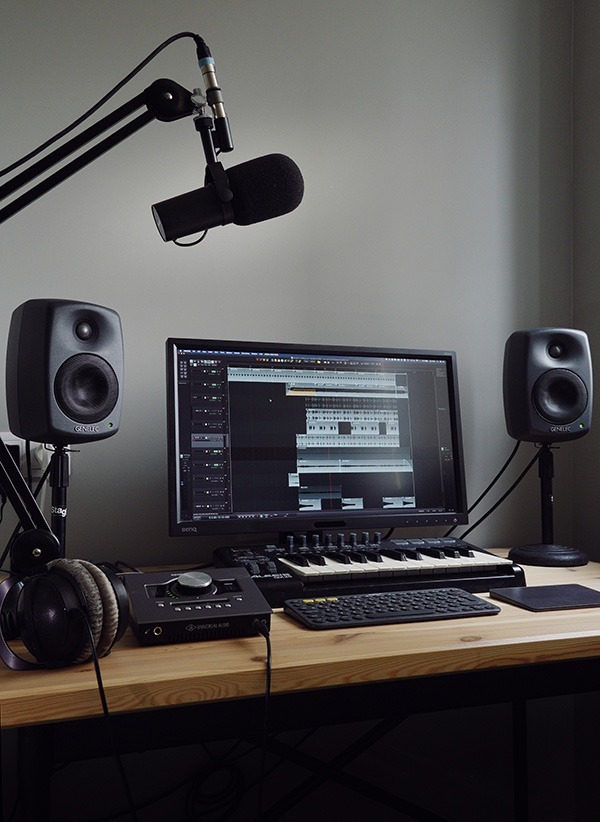
Locate an element on the screen. The image size is (600, 822). wall is located at coordinates click(499, 241).